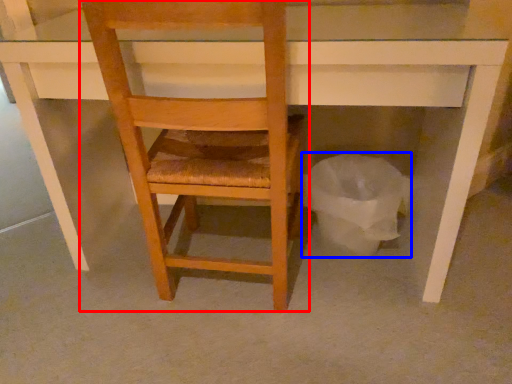
Question: Which of the following is the farthest to the observer, chair (highlighted by a red box) or garbage (highlighted by a blue box)?

Choices:
 (A) chair
 (B) garbage

Answer: (B)